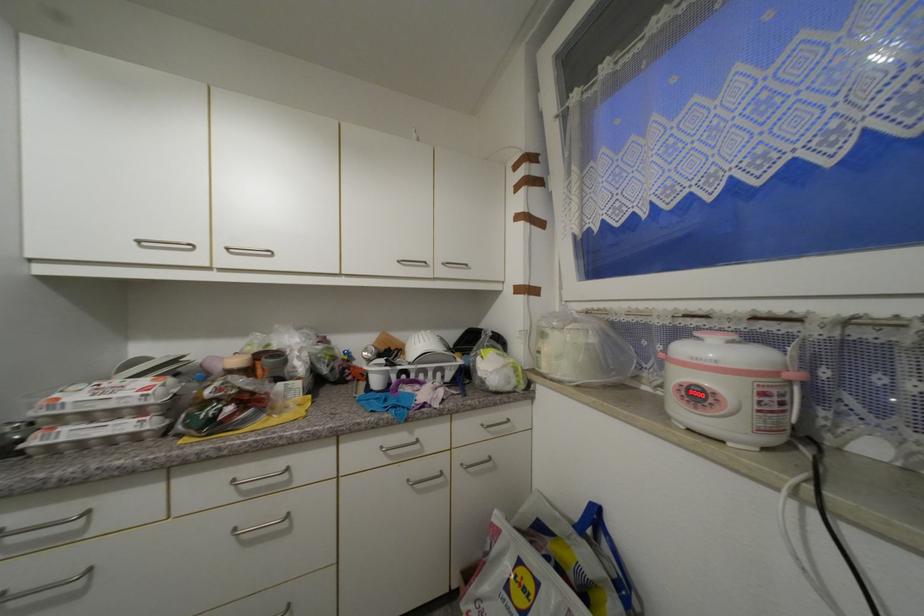
At what (x,y) coordinates should I click in order to perform the action: click on blue bag handle. Please return your answer as a coordinate pair (x, y). Looking at the image, I should click on (609, 556).